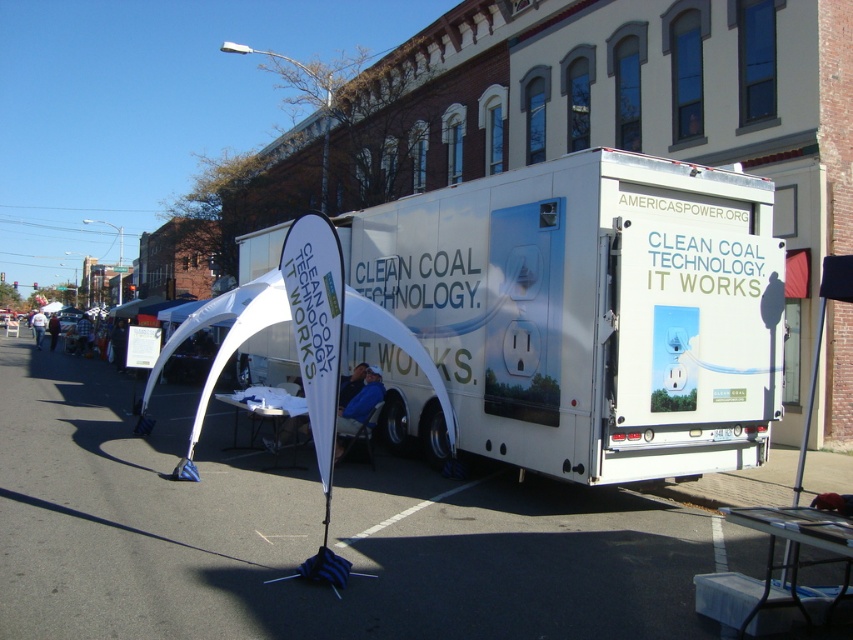
Is white fabric banner at center shorter than white fabric canopy at center?

Yes.

What are the coordinates of `white fabric banner at center` in the screenshot? It's located at (316, 324).

Looking at this image, is white vinyl trailer at center to the right of white fabric banner at center from the viewer's perspective?

Indeed, white vinyl trailer at center is positioned on the right side of white fabric banner at center.

Which is in front, point (676, 321) or point (302, 342)?

Point (302, 342)

Measure the distance between white vinyl trailer at center and camera.

They are 7.89 meters apart.

Image resolution: width=853 pixels, height=640 pixels. Find the location of `white vinyl trailer at center`. white vinyl trailer at center is located at coordinates (590, 310).

How far apart are white vinyl trailer at center and white fabric canopy at center?

The distance of white vinyl trailer at center from white fabric canopy at center is 5.98 meters.

Is white vinyl trailer at center positioned before white fabric canopy at center?

No.

Between point (521, 189) and point (209, 371), which one is positioned in front?

Positioned in front is point (521, 189).

Identify the location of white vinyl trailer at center. This screenshot has height=640, width=853. (590, 310).